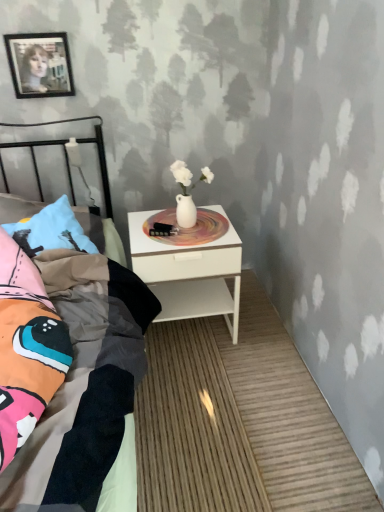
Question: Is black glossy picture frame at upper left facing away from white glossy nightstand at center?

Choices:
 (A) yes
 (B) no

Answer: (B)

Question: Considering the relative sizes of black glossy picture frame at upper left and white glossy nightstand at center in the image provided, is black glossy picture frame at upper left bigger than white glossy nightstand at center?

Choices:
 (A) no
 (B) yes

Answer: (A)

Question: Is black glossy picture frame at upper left positioned in front of white glossy nightstand at center?

Choices:
 (A) yes
 (B) no

Answer: (B)

Question: Is black glossy picture frame at upper left not close to white glossy nightstand at center?

Choices:
 (A) yes
 (B) no

Answer: (B)

Question: Is black glossy picture frame at upper left to the left of white glossy nightstand at center from the viewer's perspective?

Choices:
 (A) yes
 (B) no

Answer: (A)

Question: Is black glossy picture frame at upper left wider or thinner than white glossy nightstand at center?

Choices:
 (A) wide
 (B) thin

Answer: (B)

Question: In the image, is black glossy picture frame at upper left positioned in front of or behind white glossy nightstand at center?

Choices:
 (A) behind
 (B) front

Answer: (A)

Question: Does point coord(59,82) appear closer or farther from the camera than point coord(160,244)?

Choices:
 (A) farther
 (B) closer

Answer: (A)

Question: From a real-world perspective, relative to white glossy nightstand at center, is black glossy picture frame at upper left vertically above or below?

Choices:
 (A) below
 (B) above

Answer: (B)

Question: From a real-world perspective, is black glossy picture frame at upper left positioned above or below multicolored fabric bed at left?

Choices:
 (A) above
 (B) below

Answer: (A)

Question: From the image's perspective, is black glossy picture frame at upper left located above or below multicolored fabric bed at left?

Choices:
 (A) below
 (B) above

Answer: (B)

Question: Is black glossy picture frame at upper left in front of or behind multicolored fabric bed at left in the image?

Choices:
 (A) behind
 (B) front

Answer: (A)

Question: Considering the positions of black glossy picture frame at upper left and multicolored fabric bed at left in the image, is black glossy picture frame at upper left taller or shorter than multicolored fabric bed at left?

Choices:
 (A) tall
 (B) short

Answer: (B)

Question: Is white glossy nightstand at center taller or shorter than multicolored fabric bed at left?

Choices:
 (A) short
 (B) tall

Answer: (A)

Question: Considering the positions of point (195, 266) and point (144, 360), is point (195, 266) closer or farther from the camera than point (144, 360)?

Choices:
 (A) farther
 (B) closer

Answer: (A)